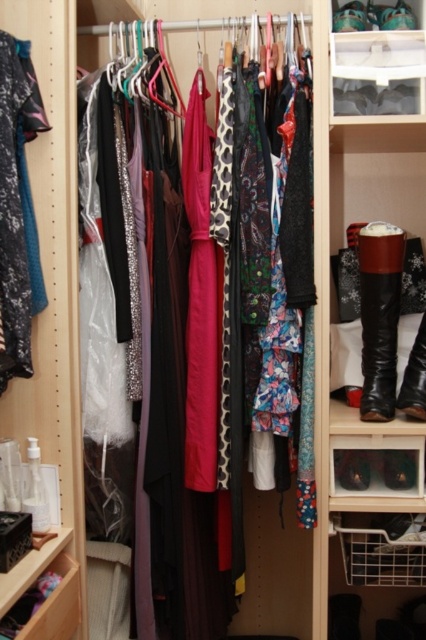
You are organizing your closet and need to place a new pair of shoes that are 30 centimeters long. You want to place them between the velvet teal dress at left and the brushed metal drawer at lower left. Is there enough space between them to fit the shoes?

The distance between the velvet teal dress at left and the brushed metal drawer at lower left is 52.50 centimeters. Since the shoes are only 30 centimeters long, there is sufficient space to place them between the two items.

You are organizing your closet and need to place a new pair of shoes in the clear plastic shoebox at upper center. However, the shoebox is currently located at point 0.094, 0.885. Is this shoebox positioned in the upper half of the closet?

The clear plastic shoebox at upper center is located at point (377,60). Since the y coordinate is 0.885, which is above 0.5, it is in the upper half of the closet.

From the picture: You are standing in front of the closet and want to reach both the point at coordinates (26, 42) and the point at coordinates (60, 570). Which coordinate point will you reach first?

You will reach point (26, 42) first because it is in front of point (60, 570).